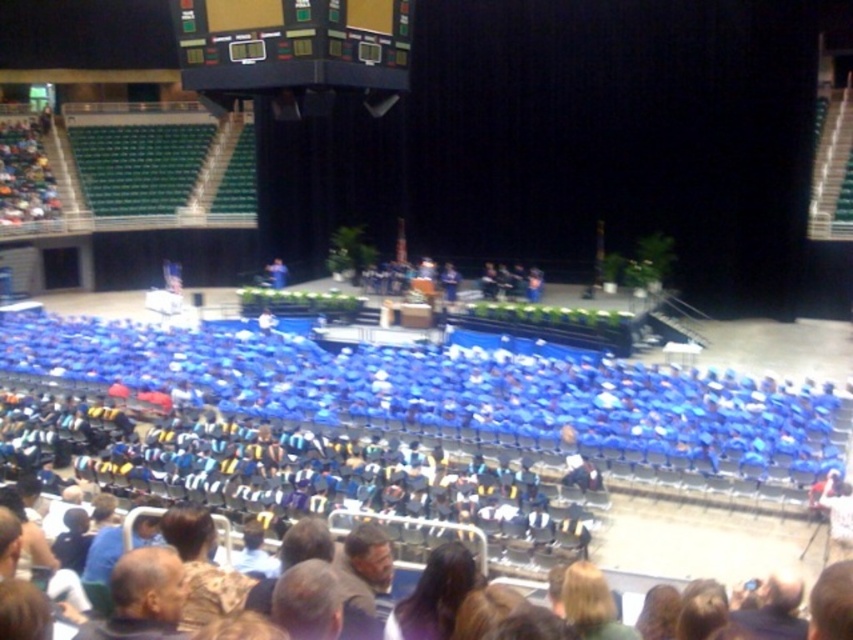
Question: From the image, what is the correct spatial relationship of black glossy scoreboard at upper center in relation to gray hair at lower left?

Choices:
 (A) right
 (B) left

Answer: (B)

Question: Among these points, which one is farthest from the camera?

Choices:
 (A) (113, 595)
 (B) (361, 3)

Answer: (B)

Question: Can you confirm if black glossy scoreboard at upper center is smaller than gray hair at lower left?

Choices:
 (A) no
 (B) yes

Answer: (A)

Question: Which point appears closest to the camera in this image?

Choices:
 (A) (392, 26)
 (B) (126, 563)

Answer: (B)

Question: Is black glossy scoreboard at upper center positioned in front of gray hair at lower left?

Choices:
 (A) no
 (B) yes

Answer: (A)